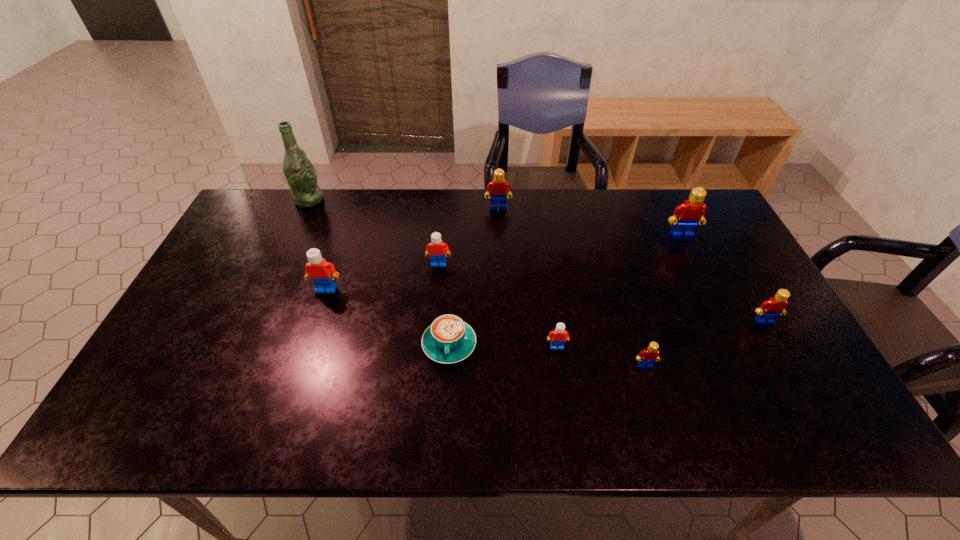
The width and height of the screenshot is (960, 540). I want to click on the leftmost object, so click(x=299, y=172).

This screenshot has width=960, height=540. Find the location of `green beer bottle`. green beer bottle is located at coordinates (299, 172).

You are a GUI agent. You are given a task and a screenshot of the screen. Output one action in this format:
    pyautogui.click(x=<x>, y=<y>)
    Task: Click on the sixth nearest Lego
    
    Given the screenshot: What is the action you would take?
    click(x=690, y=213)

You are a GUI agent. You are given a task and a screenshot of the screen. Output one action in this format:
    pyautogui.click(x=<x>, y=<y>)
    Task: Click on the tallest Lego
    The width and height of the screenshot is (960, 540).
    Given the screenshot: What is the action you would take?
    pyautogui.click(x=690, y=213)

The width and height of the screenshot is (960, 540). What are the coordinates of `the farthest Lego` in the screenshot? It's located at (497, 187).

This screenshot has width=960, height=540. What are the coordinates of `the third smallest red Lego` in the screenshot? It's located at (497, 187).

Find the location of a particular element. This screenshot has width=960, height=540. the second nearest white Lego is located at coordinates (322, 273).

I want to click on the biggest white Lego, so click(x=322, y=273).

The image size is (960, 540). I want to click on the second white Lego from right to left, so click(436, 248).

The width and height of the screenshot is (960, 540). Find the location of `the second biggest white Lego`. the second biggest white Lego is located at coordinates (436, 248).